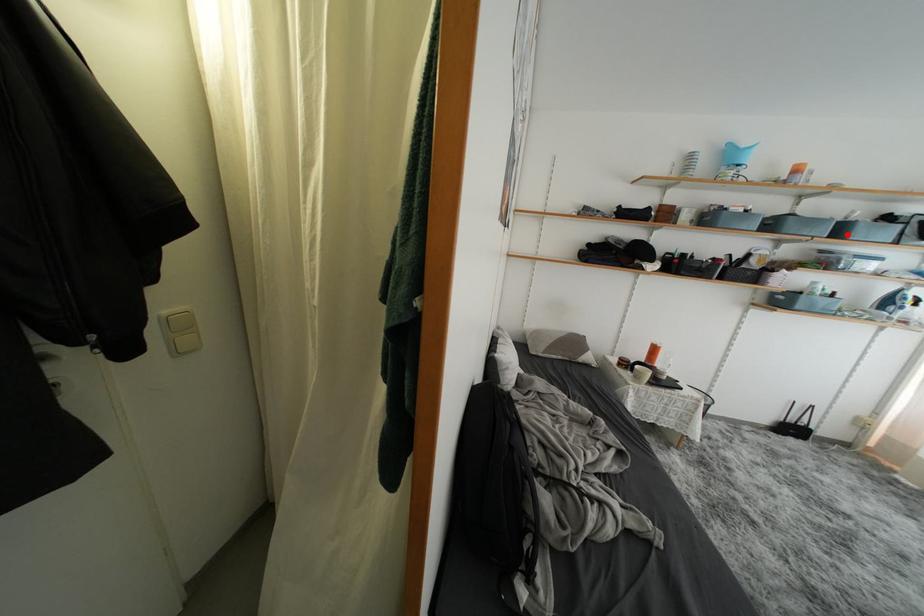
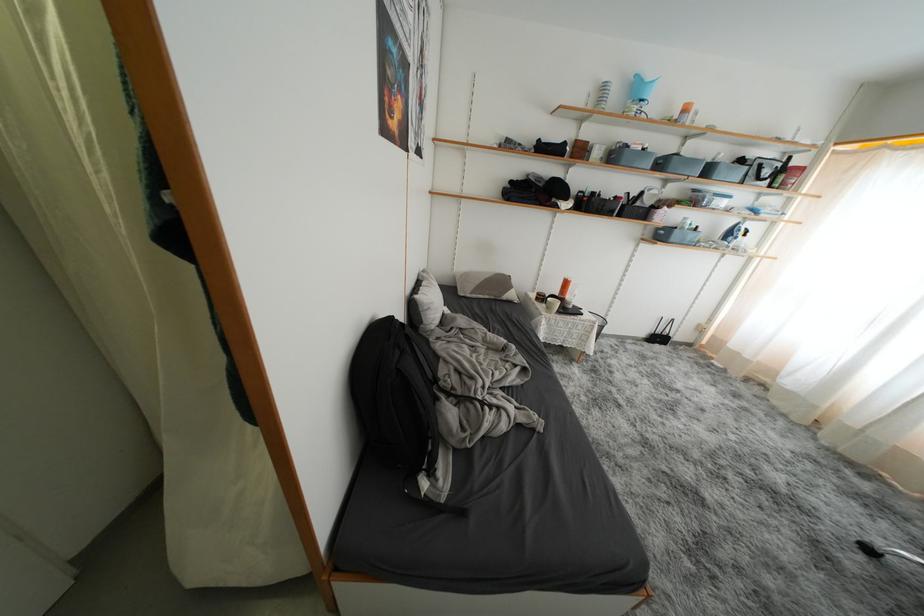
Question: A red point is marked in image1. In image2, is the corresponding 3D point closer to the camera or farther? Reply with the corresponding letter.

Choices:
 (A) The corresponding 3D point is closer.
 (B) The corresponding 3D point is farther.

Answer: (A)